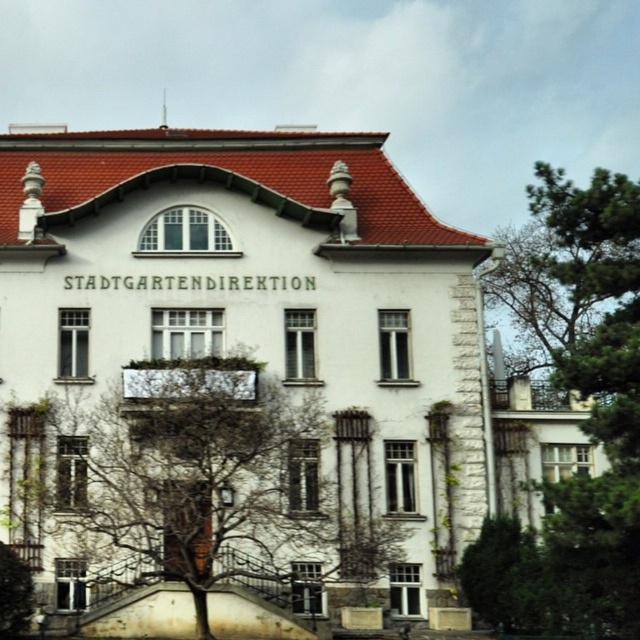
Question: Which object is farther from the camera taking this photo?

Choices:
 (A) bare branches at lower left
 (B) green leafy tree at upper right

Answer: (A)

Question: Is bare branches at lower left positioned before green leafy tree at upper right?

Choices:
 (A) no
 (B) yes

Answer: (A)

Question: Does bare branches at lower left appear on the left side of green leafy tree at upper right?

Choices:
 (A) no
 (B) yes

Answer: (B)

Question: Is bare branches at lower left wider than green leafy tree at upper right?

Choices:
 (A) no
 (B) yes

Answer: (A)